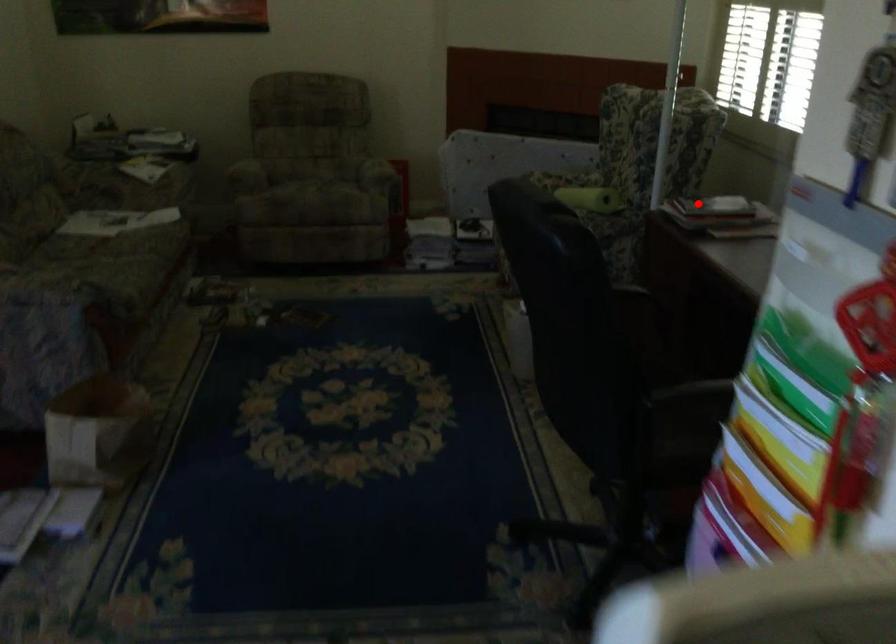
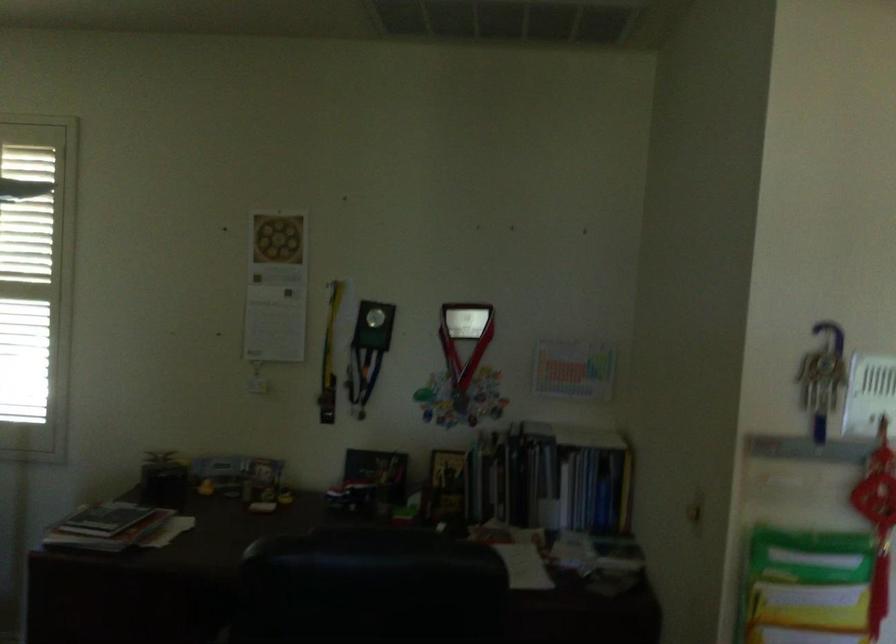
Question: I am providing you with two images of the same scene from different viewpoints. A red point is shown in image1. For the corresponding object point in image2, is it positioned nearer or farther from the camera?

Choices:
 (A) Nearer
 (B) Farther

Answer: (A)